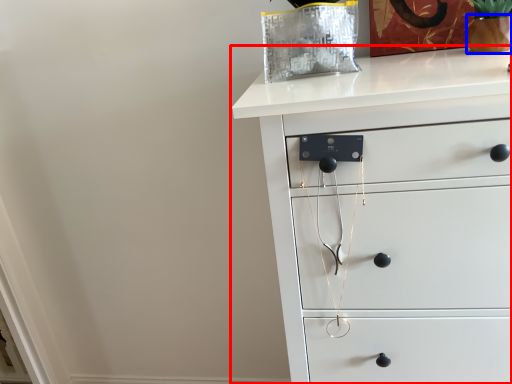
Question: Which object is closer to the camera taking this photo, chest of drawers (highlighted by a red box) or glass vase (highlighted by a blue box)?

Choices:
 (A) chest of drawers
 (B) glass vase

Answer: (A)